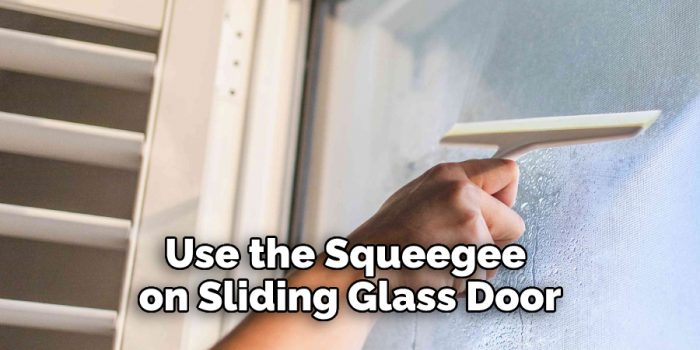
The image size is (700, 350). Identify the location of glass door. (631, 217).